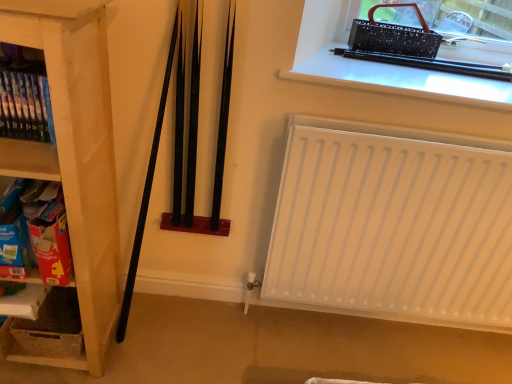
Question: Considering the relative sizes of black plastic pen at upper right and white cardboard box at lower left in the image provided, is black plastic pen at upper right taller than white cardboard box at lower left?

Choices:
 (A) no
 (B) yes

Answer: (A)

Question: From a real-world perspective, is black plastic pen at upper right positioned over white cardboard box at lower left based on gravity?

Choices:
 (A) no
 (B) yes

Answer: (B)

Question: Does black plastic pen at upper right lie behind white cardboard box at lower left?

Choices:
 (A) yes
 (B) no

Answer: (B)

Question: Is black plastic pen at upper right not within white cardboard box at lower left?

Choices:
 (A) no
 (B) yes

Answer: (B)

Question: From a real-world perspective, is black plastic pen at upper right physically below white cardboard box at lower left?

Choices:
 (A) no
 (B) yes

Answer: (A)

Question: From their relative heights in the image, would you say wooden bookshelf at left, placed as the first shelf when sorted from top to bottom, is taller or shorter than cardboard box at left, the first shelf from the bottom?

Choices:
 (A) tall
 (B) short

Answer: (B)

Question: From the image's perspective, is wooden bookshelf at left, which ranks as the third shelf in bottom-to-top order, located above or below cardboard box at left, the first shelf from the bottom?

Choices:
 (A) above
 (B) below

Answer: (A)

Question: Is wooden bookshelf at left, placed as the first shelf when sorted from top to bottom, bigger or smaller than cardboard box at left, the third shelf when ordered from top to bottom?

Choices:
 (A) big
 (B) small

Answer: (B)

Question: Is point (1, 44) closer or farther from the camera than point (33, 221)?

Choices:
 (A) closer
 (B) farther

Answer: (A)

Question: From the image's perspective, is white cardboard box at lower left positioned above or below wooden bookshelf at left, placed as the first shelf when sorted from top to bottom?

Choices:
 (A) above
 (B) below

Answer: (B)

Question: From their relative heights in the image, would you say white cardboard box at lower left is taller or shorter than wooden bookshelf at left, which ranks as the third shelf in bottom-to-top order?

Choices:
 (A) tall
 (B) short

Answer: (B)

Question: Is point (7, 337) closer or farther from the camera than point (0, 160)?

Choices:
 (A) closer
 (B) farther

Answer: (B)

Question: Is white cardboard box at lower left bigger or smaller than wooden bookshelf at left, which ranks as the third shelf in bottom-to-top order?

Choices:
 (A) big
 (B) small

Answer: (A)

Question: From the image's perspective, is white cardboard box at lower left positioned above or below white matte radiator at lower right?

Choices:
 (A) above
 (B) below

Answer: (B)

Question: Considering the positions of white cardboard box at lower left and white matte radiator at lower right in the image, is white cardboard box at lower left taller or shorter than white matte radiator at lower right?

Choices:
 (A) tall
 (B) short

Answer: (B)